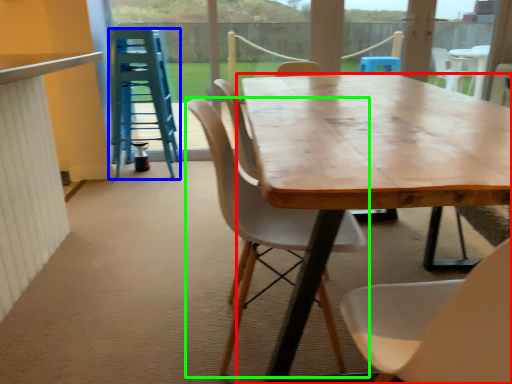
Question: Which is farther away from desk (highlighted by a red box)? stool (highlighted by a blue box) or chair (highlighted by a green box)?

Choices:
 (A) stool
 (B) chair

Answer: (A)